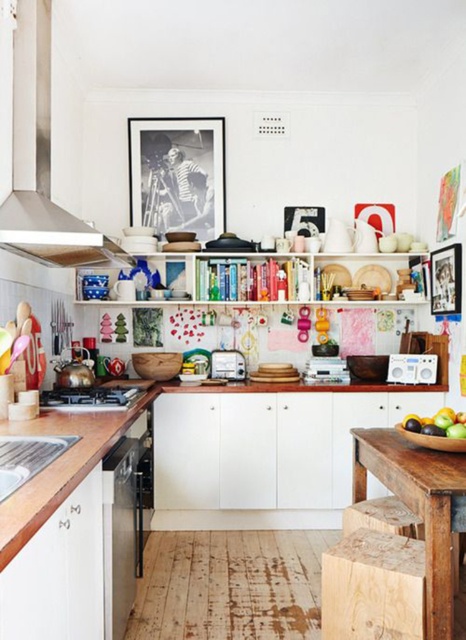
Question: Which of the following is the farthest from the observer?

Choices:
 (A) (116, 636)
 (B) (437, 266)
 (C) (242, 356)
 (D) (201, 269)

Answer: (C)

Question: Can you confirm if wooden shelves at upper center is positioned above wooden stool at lower center?

Choices:
 (A) yes
 (B) no

Answer: (A)

Question: Which point is farther to the camera?

Choices:
 (A) click(x=375, y=637)
 (B) click(x=393, y=365)

Answer: (B)

Question: Can you confirm if wooden shelves at upper center is positioned below satin silver dishwasher at lower left?

Choices:
 (A) no
 (B) yes

Answer: (A)

Question: Which object appears farthest from the camera in this image?

Choices:
 (A) wooden shelves at upper center
 (B) pine wood stool at lower center
 (C) wooden picture frame at upper center
 (D) white plastic toaster at center

Answer: (D)

Question: Where is rustic wood table at center located in relation to wooden stool at lower center in the image?

Choices:
 (A) left
 (B) right

Answer: (B)